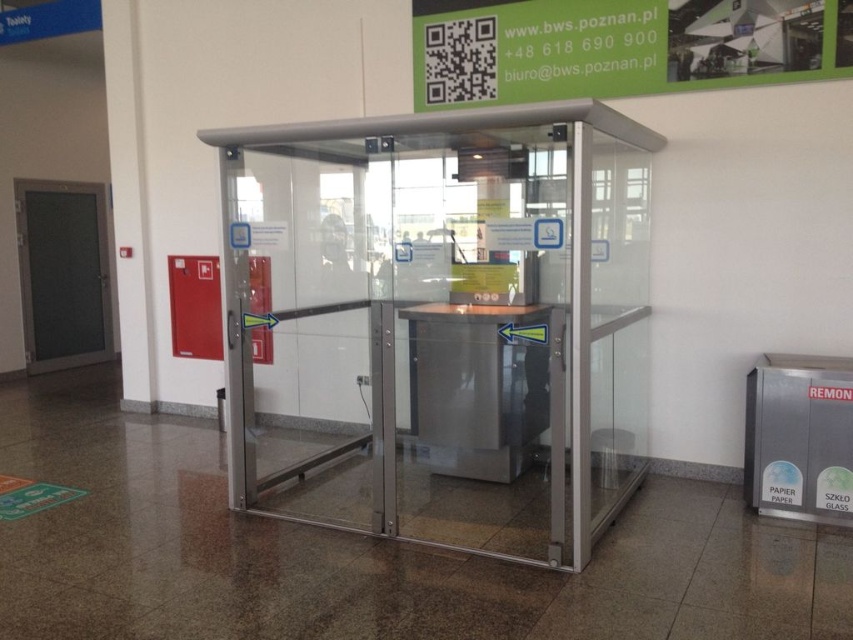
You are a maintenance worker needing to reach both the transparent glass door at center and the metallic door at left. Considering you can only carry tools to one door at a time, which door should you prioritize if you need to service the door closer to the emergency fire alarm panel?

The metallic door at left is closer to the emergency fire alarm panel, so you should prioritize servicing the metallic door at left first.

You are a maintenance worker needing to access the transparent glass door at center and the metallic door at left. Which door should you check first if you want to start from the lower part of the booth?

The transparent glass door at center is located below the metallic door at left, so you should check the transparent glass door at center first since it is positioned lower.